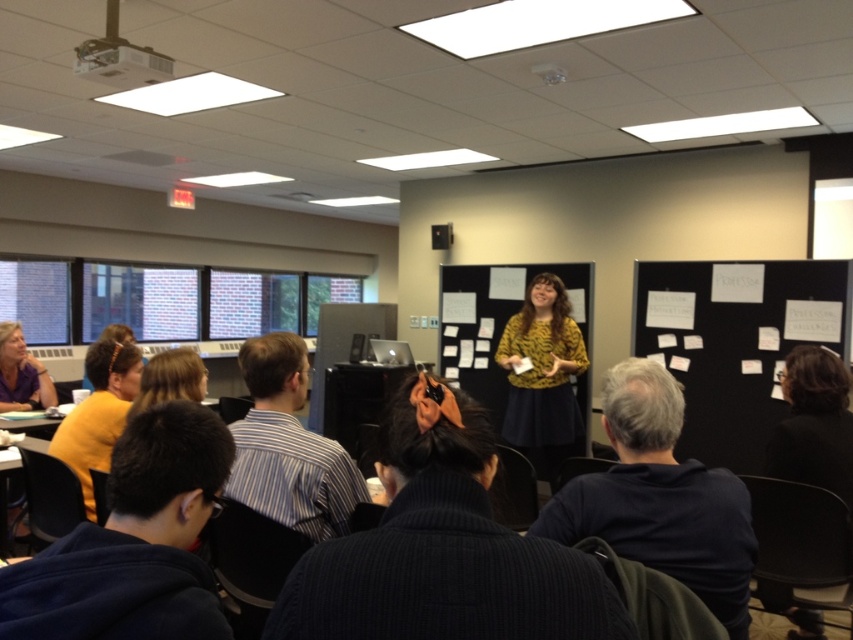
In the scene shown: In the classroom scene, there is a matte white projector at upper left and a person with blonde hair at center. Which object is located more to the left side of the scene?

The matte white projector at upper left is positioned more to the left side of the scene than the blonde hair at center.

You are an interior designer observing the classroom setup. You notice the yellow fabric hairband at lower left and the matte white projector at upper left. Which object is larger in size?

The yellow fabric hairband at lower left is bigger than the matte white projector at upper left.

You are standing at the back of the classroom and want to walk towards the front. You see two points marked in the room. Which point, point (802, 465) or point (180, 388), is closer to you?

Point (180, 388) is closer to you because it is nearer to the camera compared to point (802, 465), which is further away.